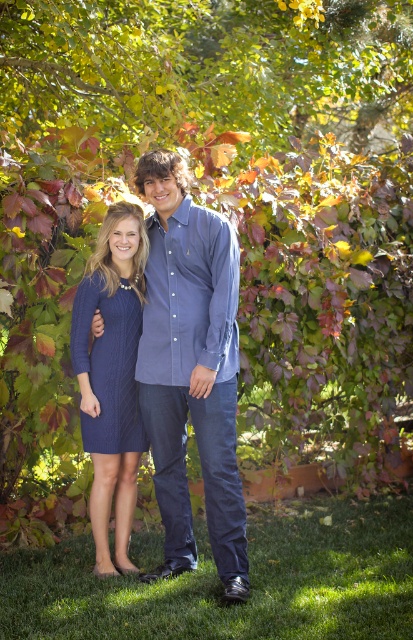
You are planning to place a small garden statue that is 1 meter wide between the green grass at lower center and the blue textured dress at center. Based on the scene description, will the statue fit between them?

The green grass at lower center is wider than the blue textured dress at center. Since the statue is 1 meter wide, the available space between them must be at least 1 meter. However, without specific measurements of the distance between the two objects, we cannot confirm if the statue will fit. The description only compares their widths, not the space between them.

You are a photographer setting up a shot in the garden. You need to ensure the blue textured dress at center is visible above the green grass at lower center. Based on the scene description, is this possible?

The green grass at lower center has a lesser height compared to the blue textured dress at center, so yes, the blue textured dress at center will be visible above the green grass at lower center.